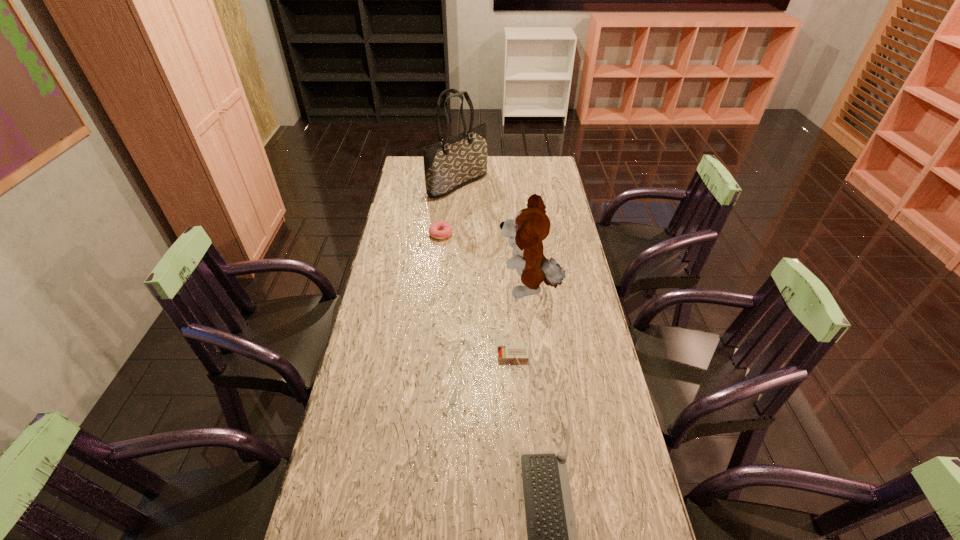
At what (x,y) coordinates should I click in order to perform the action: click on free space located on the face of the second tallest object. Please return your answer as a coordinate pair (x, y). The height and width of the screenshot is (540, 960). Looking at the image, I should click on (388, 288).

I want to click on vacant space situated 0.300m on the face of the second tallest object, so click(x=414, y=288).

Locate an element on the screen. Image resolution: width=960 pixels, height=540 pixels. vacant space located on the right of the third tallest object is located at coordinates (472, 234).

The image size is (960, 540). Find the location of `free space located on the striking surface of the second shortest object`. free space located on the striking surface of the second shortest object is located at coordinates (516, 394).

Where is `object that is at the far edge`? The height and width of the screenshot is (540, 960). object that is at the far edge is located at coordinates (450, 164).

Identify the location of object that is at the left edge. This screenshot has height=540, width=960. (450, 164).

Where is `object located at the right edge`? The width and height of the screenshot is (960, 540). object located at the right edge is located at coordinates (531, 225).

Where is `object that is at the far left corner`? object that is at the far left corner is located at coordinates (450, 164).

I want to click on vacant region at the far edge, so click(499, 180).

Where is `blank space at the left edge`? blank space at the left edge is located at coordinates (397, 260).